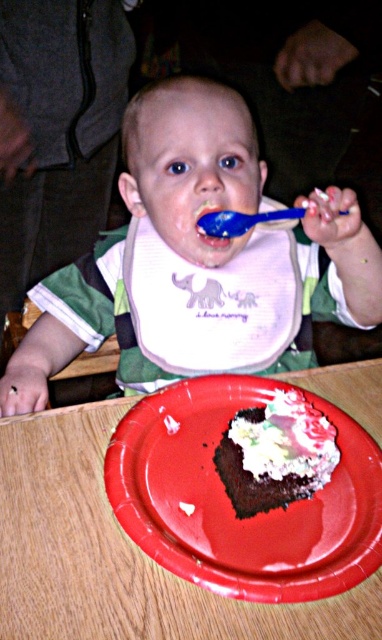
Can you confirm if smooth red paper plate at lower center is positioned to the right of blue glossy toothbrush at center?

Yes, smooth red paper plate at lower center is to the right of blue glossy toothbrush at center.

Who is lower down, smooth red paper plate at lower center or blue glossy toothbrush at center?

Positioned lower is smooth red paper plate at lower center.

You are a GUI agent. You are given a task and a screenshot of the screen. Output one action in this format:
    pyautogui.click(x=<x>, y=<y>)
    Task: Click on the smooth red paper plate at lower center
    
    Given the screenshot: What is the action you would take?
    pyautogui.click(x=231, y=502)

Does point (216, 225) come farther from viewer compared to point (218, 212)?

No, it is not.

In the scene shown: Does blue plastic spoon at upper center have a smaller size compared to blue glossy toothbrush at center?

Incorrect, blue plastic spoon at upper center is not smaller in size than blue glossy toothbrush at center.

Between point (221, 236) and point (205, 241), which one is positioned behind?

Point (205, 241)

Identify the location of blue plastic spoon at upper center. (242, 220).

Measure the distance between chocolatesmoothcake at center and camera.

They are 52.52 centimeters apart.

Does chocolatesmoothcake at center have a smaller size compared to blue glossy toothbrush at center?

No.

Does point (330, 467) lie in front of point (197, 211)?

Yes.

Locate an element on the screen. The width and height of the screenshot is (382, 640). chocolatesmoothcake at center is located at coordinates (276, 452).